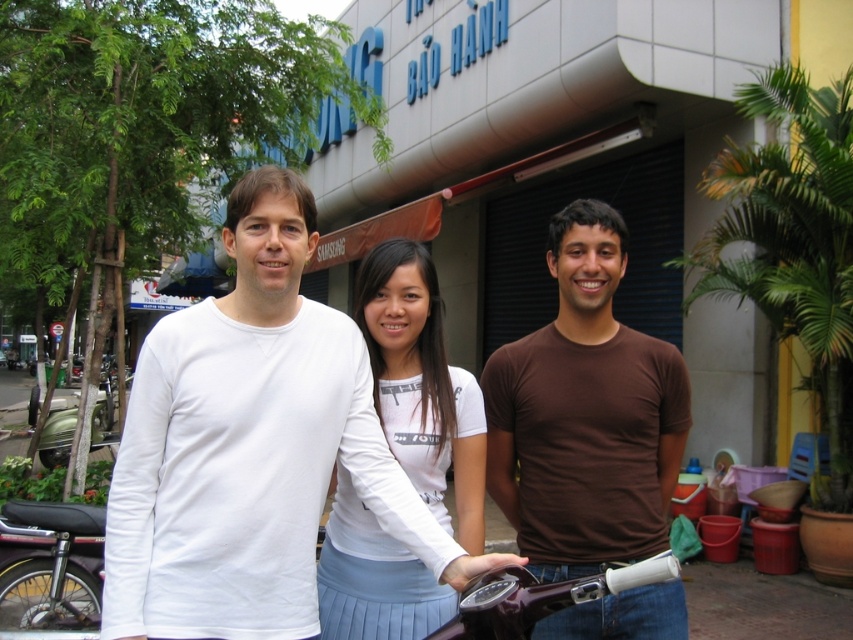
Question: Does brown cotton t-shirt at center have a smaller size compared to white cotton shirt at center?

Choices:
 (A) no
 (B) yes

Answer: (A)

Question: Does white matte shirt at center have a lesser width compared to brown cotton t-shirt at center?

Choices:
 (A) no
 (B) yes

Answer: (A)

Question: Which object is the farthest from the white cotton shirt at center?

Choices:
 (A) brown cotton t-shirt at center
 (B) white matte shirt at center

Answer: (A)

Question: Observing the image, what is the correct spatial positioning of white matte shirt at center in reference to brown cotton t-shirt at center?

Choices:
 (A) below
 (B) above

Answer: (B)

Question: Which of these objects is positioned closest to the white cotton shirt at center?

Choices:
 (A) white matte shirt at center
 (B) brown cotton t-shirt at center

Answer: (A)

Question: Which point appears closest to the camera in this image?

Choices:
 (A) (351, 628)
 (B) (601, 524)
 (C) (213, 330)

Answer: (C)